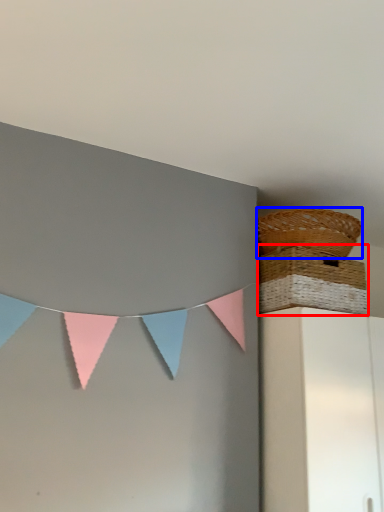
Question: Among these objects, which one is nearest to the camera, picnic basket (highlighted by a red box) or picnic basket (highlighted by a blue box)?

Choices:
 (A) picnic basket
 (B) picnic basket

Answer: (A)